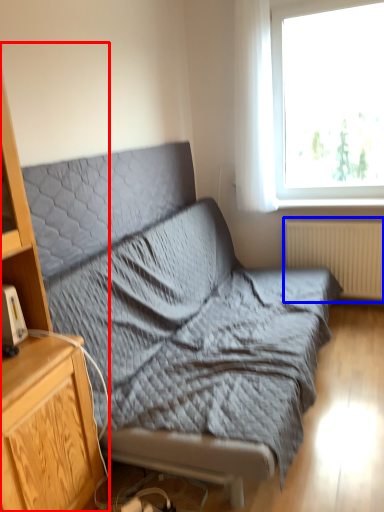
Question: Which of the following is the closest to the observer, cabinetry (highlighted by a red box) or radiator (highlighted by a blue box)?

Choices:
 (A) cabinetry
 (B) radiator

Answer: (A)